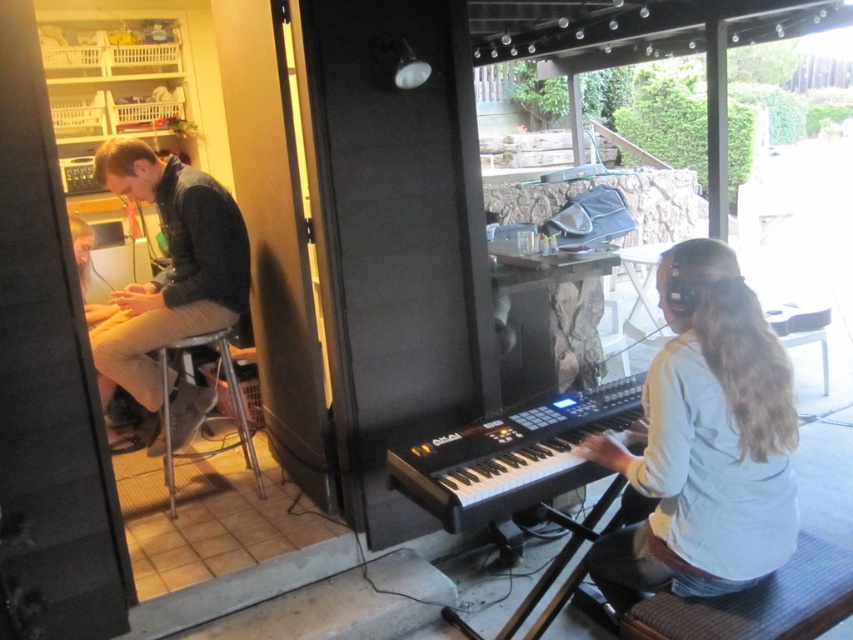
You are a delivery person who needs to place a package between the black plastic keyboard at center and the metallic silver stool at lower left. The package is 1.5 meters long. Can you fit it between them?

The black plastic keyboard at center and metallic silver stool at lower left are 1.40 meters apart from each other. Since the package is 1.5 meters long, it cannot fit between them as the distance is shorter than the package length.

You are standing at the entrance of the room and see the point marked at coordinates (704, 444). What object is located at that point?

The white matte shirt at right is located at point (704, 444).

You are setting up a small stage for a performance. You have a black plastic keyboard at center and a metallic silver stool at lower left. Which object should you place closer to the audience to ensure visibility?

The black plastic keyboard at center should be placed closer to the audience since its width is larger than the metallic silver stool at lower left, making it more noticeable from a distance.